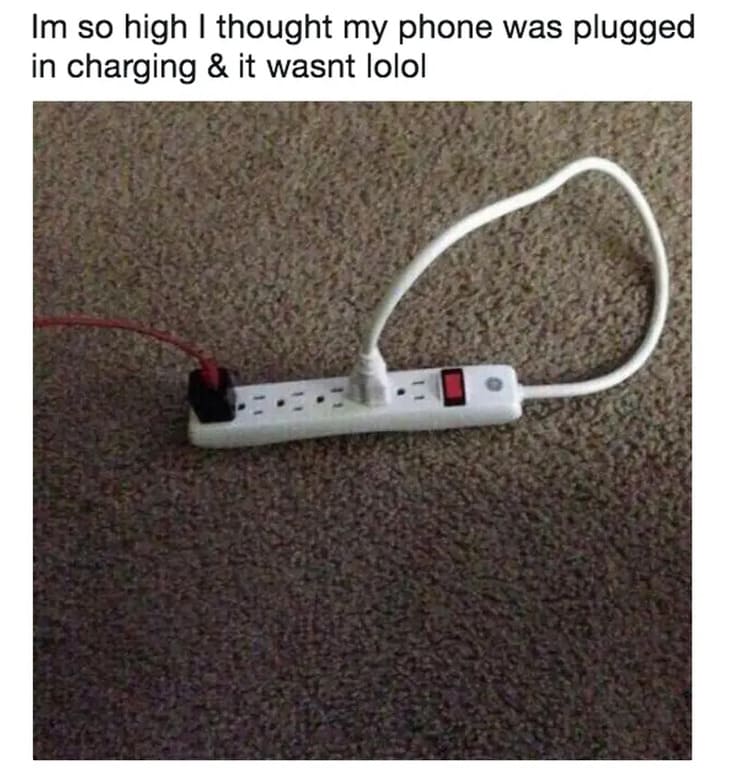
Find the location of a particular element. floor is located at coordinates (566, 590).